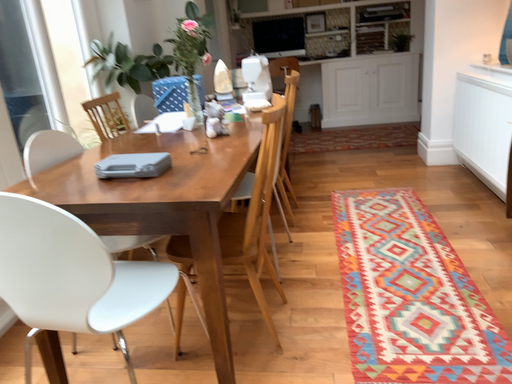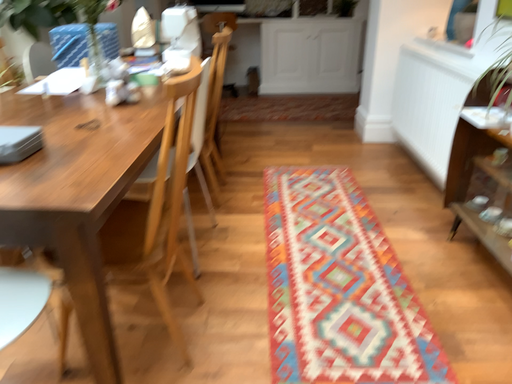
Question: Which way did the camera rotate in the video?

Choices:
 (A) rotated left
 (B) rotated right

Answer: (B)